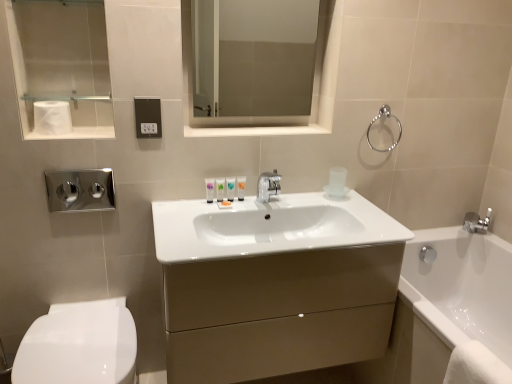
Find the location of a particular element. vacant space to the right of translucent plastic tube at center, which is counted as the second toiletry, starting from the right is located at coordinates (266, 203).